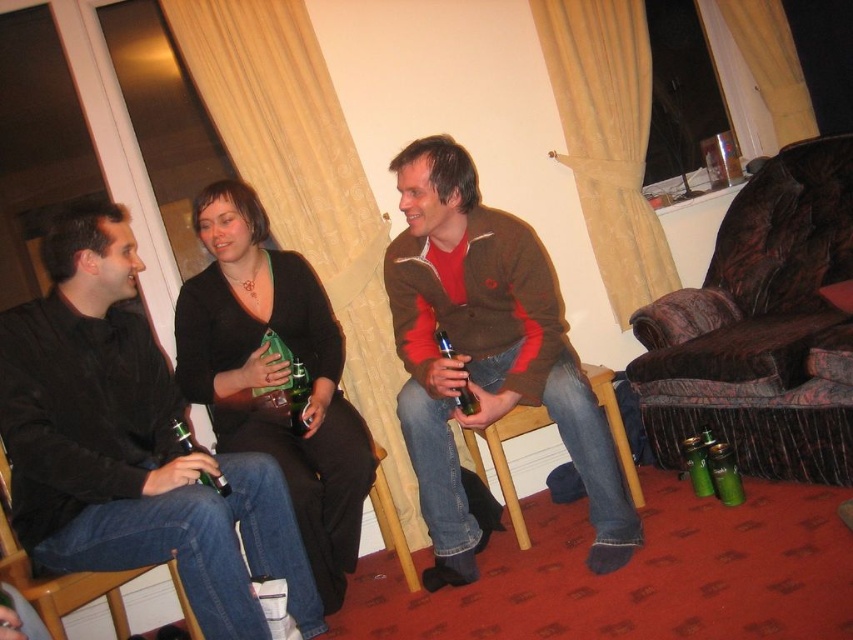
Question: Estimate the real-world distances between objects in this image. Which object is closer to the green glass bottle at center?

Choices:
 (A) velvet-patterned armchair at right
 (B) black leather armchair at left
 (C) matte black shirt at left
 (D) matte glass bottle at center

Answer: (D)

Question: Among these objects, which one is farthest from the camera?

Choices:
 (A) matte black shirt at left
 (B) green glass bottle at center
 (C) green glass bottle at lower left
 (D) matte glass bottle at center

Answer: (B)

Question: Does black leather armchair at left appear on the right side of green glass bottle at center?

Choices:
 (A) yes
 (B) no

Answer: (B)

Question: Does matte black sweater at center appear over matte glass bottle at center?

Choices:
 (A) yes
 (B) no

Answer: (B)

Question: Which object is positioned closest to the green glass bottle at center?

Choices:
 (A) matte black sweater at center
 (B) green glass bottle at lower left

Answer: (A)

Question: Does velvet-patterned armchair at right have a larger size compared to matte black sweater at center?

Choices:
 (A) yes
 (B) no

Answer: (A)